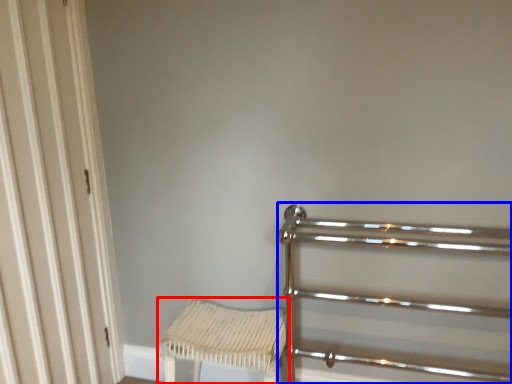
Question: Which point is further to the camera, furniture (highlighted by a red box) or rail (highlighted by a blue box)?

Choices:
 (A) furniture
 (B) rail

Answer: (A)